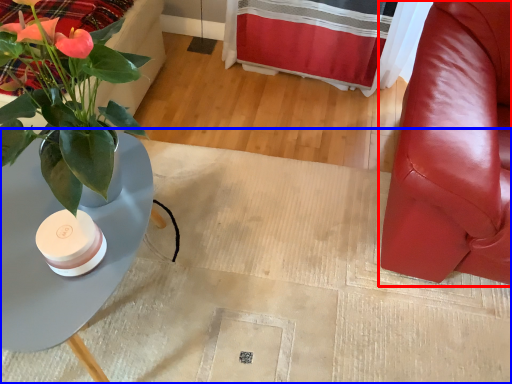
Question: Which object appears closest to the camera in this image, chair (highlighted by a red box) or plain (highlighted by a blue box)?

Choices:
 (A) chair
 (B) plain

Answer: (A)